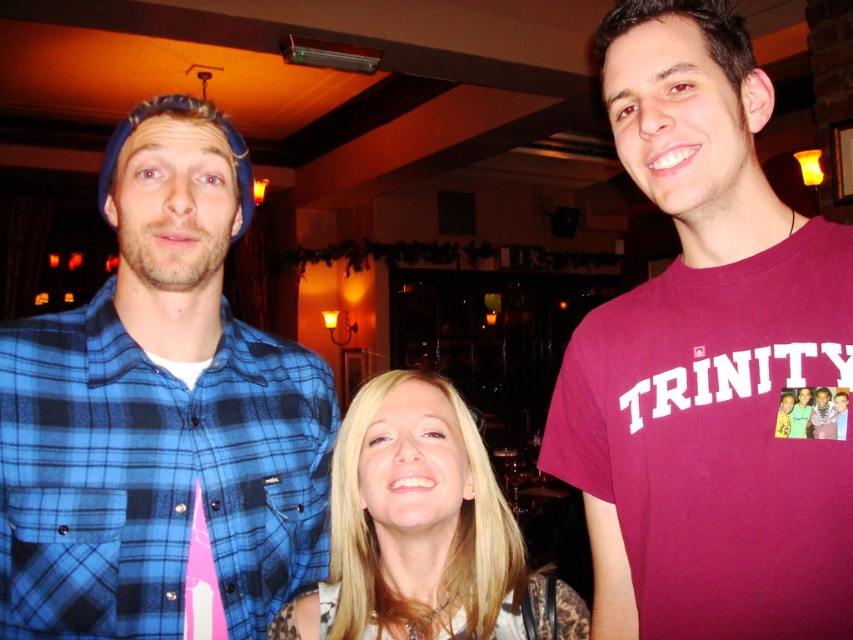
You are at a social gathering in a dimly lit venue. You see three people. The first person is wearing a blue plaid shirt over a pink t shirt and a dark blue beanie. The second person has long blonde hair and is smiling warmly at the camera in a light colored top with a patterned design. The third person is at point (705, 360). What is the third person wearing?

The third person at point (705, 360) is wearing a maroon t shirt at center.

You are at a party and want to take a photo of the blue flannel shirt at left and the blonde hair at center. Which one should you focus on first if you want to capture both in the same frame?

The blue flannel shirt at left is above the blonde hair at center, so you should focus on the blue flannel shirt at left first to ensure both are in the frame.